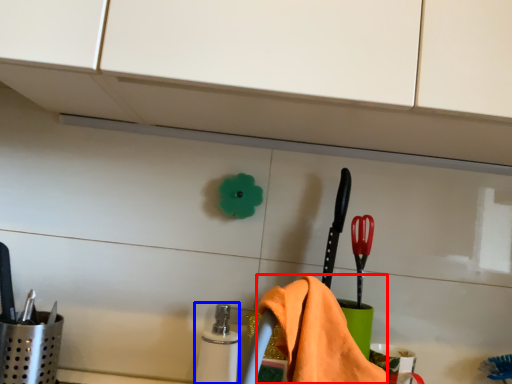
Question: Which object is further to the camera taking this photo, bath towel (highlighted by a red box) or toiletry (highlighted by a blue box)?

Choices:
 (A) bath towel
 (B) toiletry

Answer: (B)